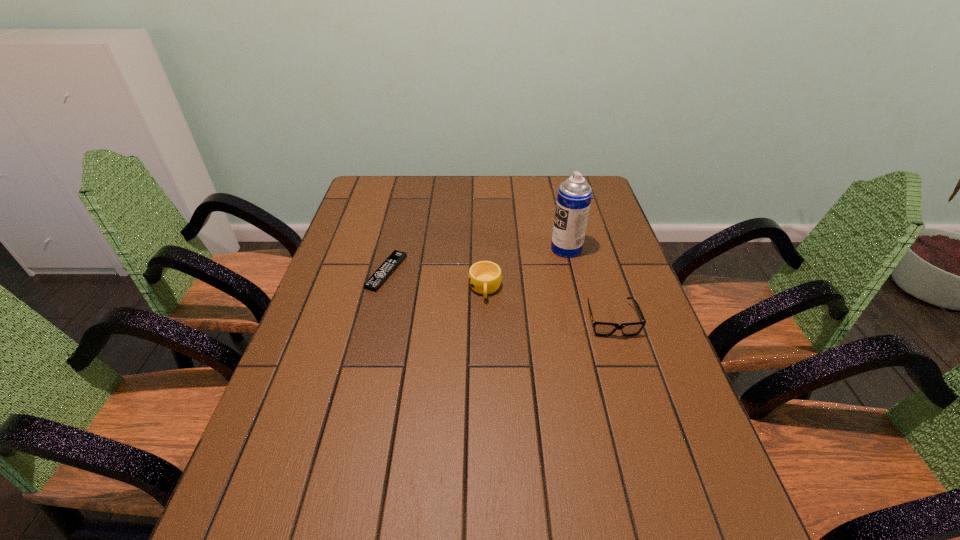
The image size is (960, 540). What are the coordinates of `the tallest object` in the screenshot? It's located at (574, 196).

Image resolution: width=960 pixels, height=540 pixels. I want to click on the second tallest object, so click(x=485, y=277).

Find the location of `cup`. cup is located at coordinates (485, 277).

At what (x,y) coordinates should I click in order to perform the action: click on the second shortest object. Please return your answer as a coordinate pair (x, y). Image resolution: width=960 pixels, height=540 pixels. Looking at the image, I should click on (605, 329).

In order to click on the leftmost object in this screenshot , I will do `click(380, 276)`.

Identify the location of remote control. This screenshot has width=960, height=540. (380, 276).

The width and height of the screenshot is (960, 540). Identify the location of vacant space located on the label side of the tallest object. (510, 248).

The image size is (960, 540). I want to click on vacant point located on the label side of the tallest object, so click(493, 248).

Image resolution: width=960 pixels, height=540 pixels. I want to click on free space located on the label side of the tallest object, so click(x=484, y=248).

The width and height of the screenshot is (960, 540). I want to click on vacant region located on the right of the second tallest object, so click(x=612, y=289).